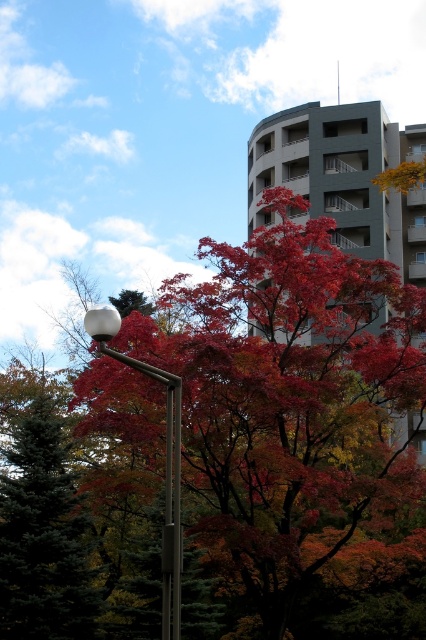
Based on the photo, does shiny red leaves at center appear over gray concrete building at center?

Actually, shiny red leaves at center is below gray concrete building at center.

Does point (242, 353) come farther from viewer compared to point (354, 248)?

No, (242, 353) is closer to viewer.

Is point (308, 305) positioned in front of point (333, 170)?

That is True.

Locate an element on the screen. Image resolution: width=426 pixels, height=640 pixels. shiny red leaves at center is located at coordinates (290, 397).

Who is more distant from viewer, (8, 582) or (169, 580)?

Positioned behind is point (8, 582).

Where is `green matte tree at left`? This screenshot has height=640, width=426. green matte tree at left is located at coordinates (40, 524).

In the scene shown: Does green matte tree at left appear on the right side of gray concrete building at center?

In fact, green matte tree at left is to the left of gray concrete building at center.

Is green matte tree at left to the left of gray concrete building at center from the viewer's perspective?

Correct, you'll find green matte tree at left to the left of gray concrete building at center.

Is point (86, 634) less distant than point (325, 120)?

That is True.

Image resolution: width=426 pixels, height=640 pixels. I want to click on green matte tree at left, so click(40, 524).